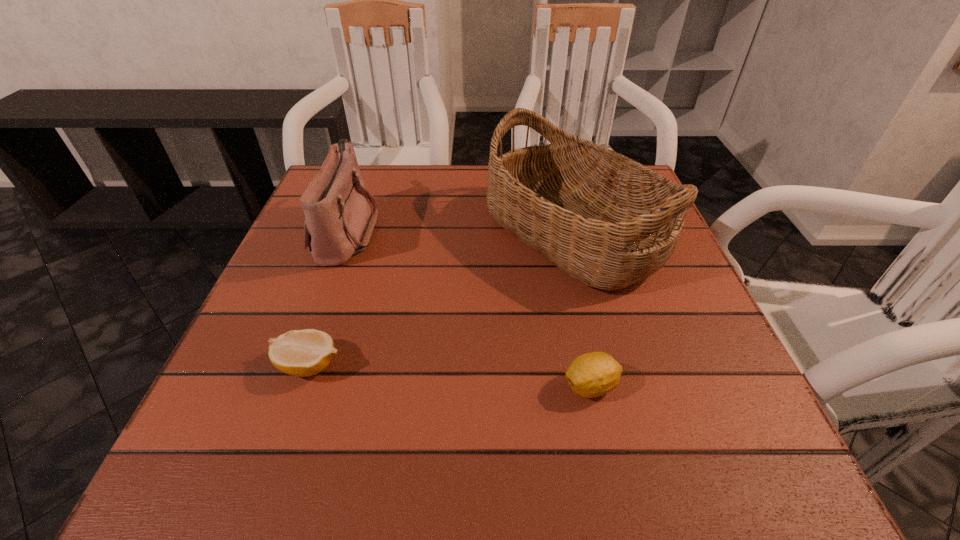
Locate an element on the screen. free space at the near edge of the desktop is located at coordinates (620, 470).

In the image, there is a desktop. At what (x,y) coordinates should I click in order to perform the action: click on vacant area at the left edge. Please return your answer as a coordinate pair (x, y). This screenshot has height=540, width=960. Looking at the image, I should click on (310, 269).

The width and height of the screenshot is (960, 540). Identify the location of vacant space at the right edge of the desktop. (675, 286).

In order to click on vacant space at the far left corner of the desktop in this screenshot , I will do `click(372, 181)`.

At what (x,y) coordinates should I click in order to perform the action: click on free area in between the basket and the third shortest object. Please return your answer as a coordinate pair (x, y). Looking at the image, I should click on (460, 232).

This screenshot has height=540, width=960. In order to click on unoccupied area between the second shortest object and the basket in this screenshot , I will do `click(582, 310)`.

Locate an element on the screen. Image resolution: width=960 pixels, height=540 pixels. blank region between the tallest object and the shoulder bag is located at coordinates (460, 232).

Where is `free point between the second tallest object and the second shortest object`? free point between the second tallest object and the second shortest object is located at coordinates (468, 308).

Where is `vacant region between the shorter lemon and the basket`? Image resolution: width=960 pixels, height=540 pixels. vacant region between the shorter lemon and the basket is located at coordinates (441, 299).

You are a GUI agent. You are given a task and a screenshot of the screen. Output one action in this format:
    pyautogui.click(x=<x>, y=<y>)
    Task: Click on the free point between the basket and the second tallest object
    This screenshot has height=540, width=960.
    Given the screenshot: What is the action you would take?
    pos(460,232)